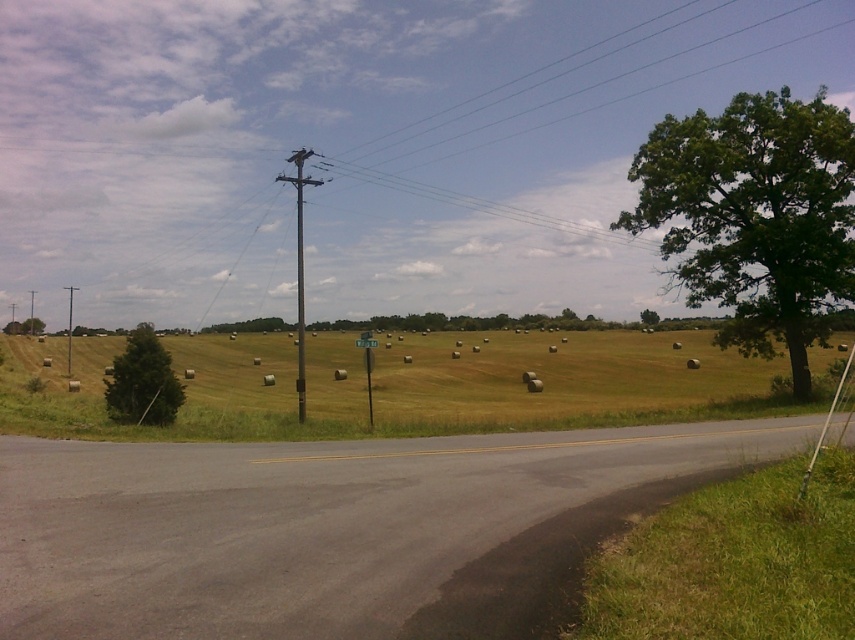
Question: Where is brushed metal telegraph pole at left located in relation to green leafy tree at center in the image?

Choices:
 (A) below
 (B) above

Answer: (A)

Question: Which object is positioned closest to the brushed metal telegraph pole at left?

Choices:
 (A) green grassy field at center
 (B) metallic pole at upper center

Answer: (A)

Question: Which is nearer to the green leafy tree at center?

Choices:
 (A) brushed metal telegraph pole at left
 (B) green matte tree at left
 (C) green leafy tree at upper right
 (D) green grassy field at center

Answer: (C)

Question: Is green grassy field at center bigger than brushed metal telegraph pole at left?

Choices:
 (A) no
 (B) yes

Answer: (A)

Question: Which object appears closest to the camera in this image?

Choices:
 (A) green leafy tree at center
 (B) metallic pole at upper center

Answer: (B)

Question: Is the position of green leafy tree at upper right less distant than that of green matte tree at left?

Choices:
 (A) yes
 (B) no

Answer: (B)